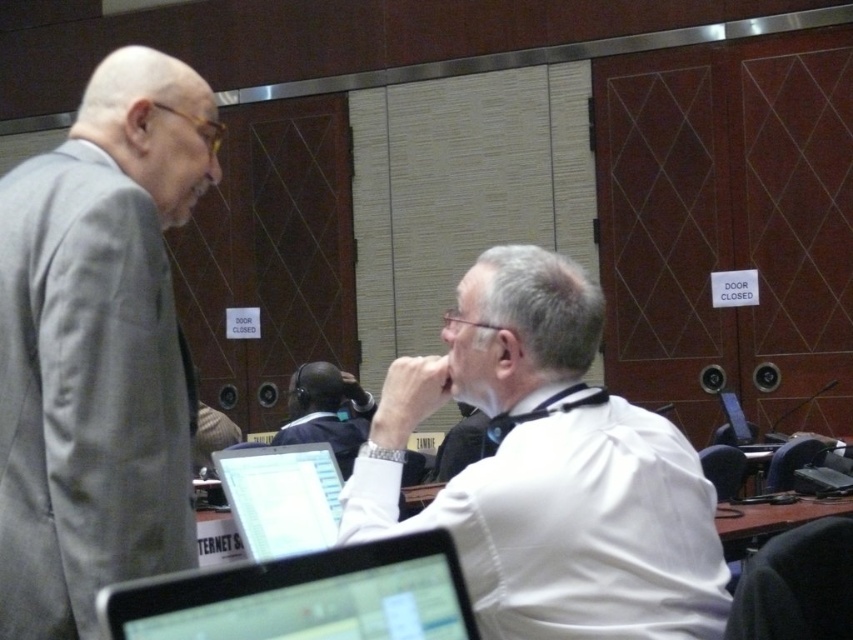
Who is lower down, white shirt at center or matte black computer screen at center?

matte black computer screen at center is lower down.

Can you confirm if white shirt at center is bigger than matte black computer screen at center?

Correct, white shirt at center is larger in size than matte black computer screen at center.

Locate an element on the screen. white shirt at center is located at coordinates (549, 470).

You are a GUI agent. You are given a task and a screenshot of the screen. Output one action in this format:
    pyautogui.click(x=<x>, y=<y>)
    Task: Click on the white shirt at center
    
    Given the screenshot: What is the action you would take?
    pyautogui.click(x=549, y=470)

Is matte black computer screen at center wider than dark blue shirt at center?

Incorrect, matte black computer screen at center's width does not surpass dark blue shirt at center's.

Is matte black computer screen at center taller than dark blue shirt at center?

Incorrect, matte black computer screen at center's height is not larger of dark blue shirt at center's.

Is point (311, 486) in front of point (306, 387)?

Yes, it is in front of point (306, 387).

Identify the location of matte black computer screen at center. (281, 497).

Between white shirt at center and dark blue shirt at center, which one appears on the right side from the viewer's perspective?

white shirt at center is more to the right.

Describe the element at coordinates (549, 470) in the screenshot. This screenshot has height=640, width=853. I see `white shirt at center` at that location.

Between point (672, 563) and point (343, 374), which one is positioned in front?

Point (672, 563)

What are the coordinates of `white shirt at center` in the screenshot? It's located at (549, 470).